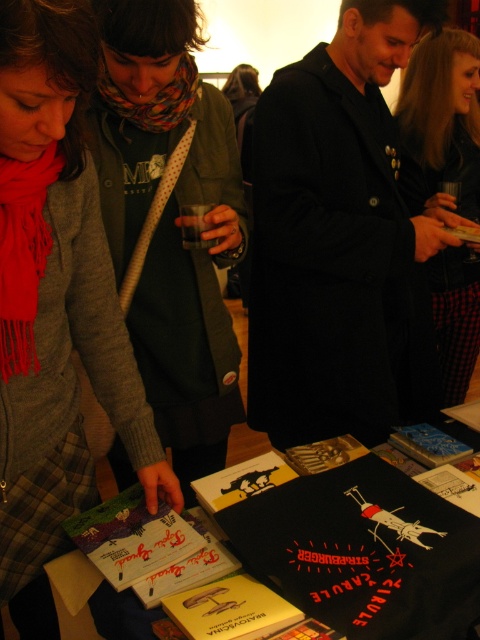
Can you confirm if red silk scarf at left is thinner than multicolored knitted scarf at center?

Yes.

From the picture: Who is higher up, red silk scarf at left or multicolored knitted scarf at center?

multicolored knitted scarf at center is higher up.

Is point (19, 241) more distant than point (106, 74)?

No, it is in front of (106, 74).

The width and height of the screenshot is (480, 640). I want to click on red silk scarf at left, so click(x=23, y=253).

Which is above, black wool coat at center or matte gray scarf at lower left?

black wool coat at center is above.

Can you confirm if black wool coat at center is taller than matte gray scarf at lower left?

Yes, black wool coat at center is taller than matte gray scarf at lower left.

Locate an element on the screen. The height and width of the screenshot is (640, 480). black wool coat at center is located at coordinates (339, 243).

Between point (66, 477) and point (182, 592), which one is positioned behind?

Point (66, 477)

Does matte gray scarf at lower left have a smaller size compared to yellow paper book at center?

Incorrect, matte gray scarf at lower left is not smaller in size than yellow paper book at center.

Which is in front, point (163, 465) or point (279, 598)?

Positioned in front is point (279, 598).

The height and width of the screenshot is (640, 480). What are the coordinates of `matte gray scarf at lower left` in the screenshot? It's located at (54, 301).